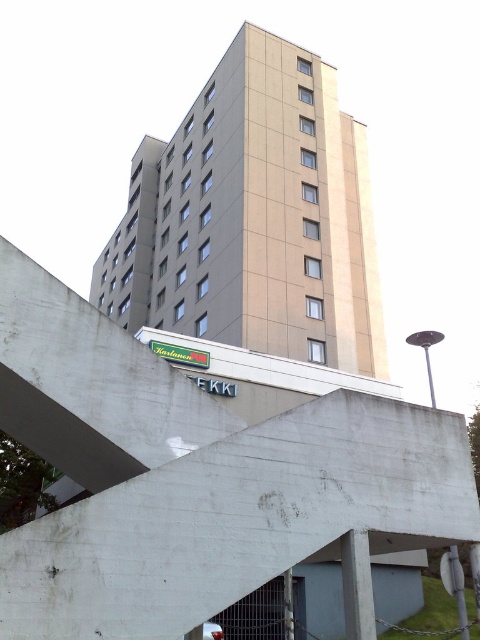
Does concrete at center appear on the right side of beige concrete building at center?

Yes, concrete at center is to the right of beige concrete building at center.

Is concrete at center smaller than beige concrete building at center?

Yes.

Does point (269, 454) come farther from viewer compared to point (219, 136)?

No.

Locate an element on the screen. concrete at center is located at coordinates (204, 472).